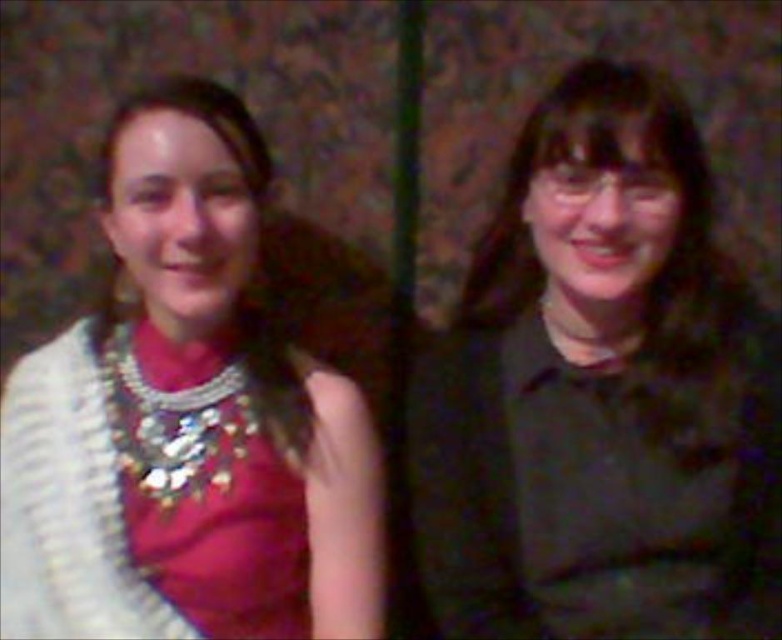
You are trying to decide which necklace to buy for a gift. Both the shiny silver necklace at left and the shiny metallic necklace at left are available. If you want the wider one, which should you choose?

The shiny silver necklace at left is wider than the shiny metallic necklace at left, so you should choose the shiny silver necklace at left.

Looking at this image, you are a photographer adjusting the camera settings in a dimly lit room. You notice two items in the scene that might reflect light differently. The dark green shirt at right and the shiny silver necklace at left. Which item would likely cause more glare or reflection due to its surface properties?

The shiny silver necklace at left has a reflective surface, so it would likely cause more glare or reflection than the dark green shirt at right.

You are a photographer adjusting the focus on your camera. You want to capture both the dark green shirt at right and the shiny metallic necklace at left in sharp detail. Given that your camera can focus clearly on objects within a 20 inch range, will both subjects be in focus?

The dark green shirt at right is 22.36 inches away from the shiny metallic necklace at left. Since the distance between them exceeds the camera focus range of 20 inches, both subjects cannot be in focus simultaneously.